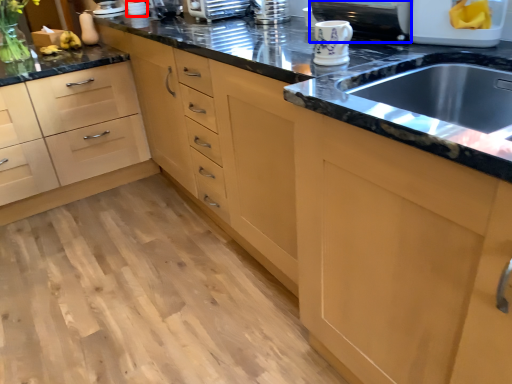
Question: Which point is closer to the camera, appliance (highlighted by a red box) or appliance (highlighted by a blue box)?

Choices:
 (A) appliance
 (B) appliance

Answer: (B)